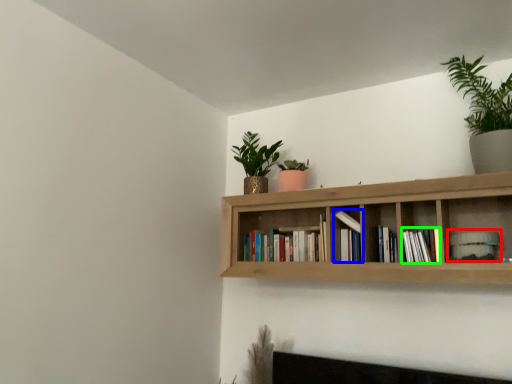
Question: Which object is the closest to the book (highlighted by a red box)? Choose among these: book (highlighted by a blue box) or book (highlighted by a green box).

Choices:
 (A) book
 (B) book

Answer: (B)